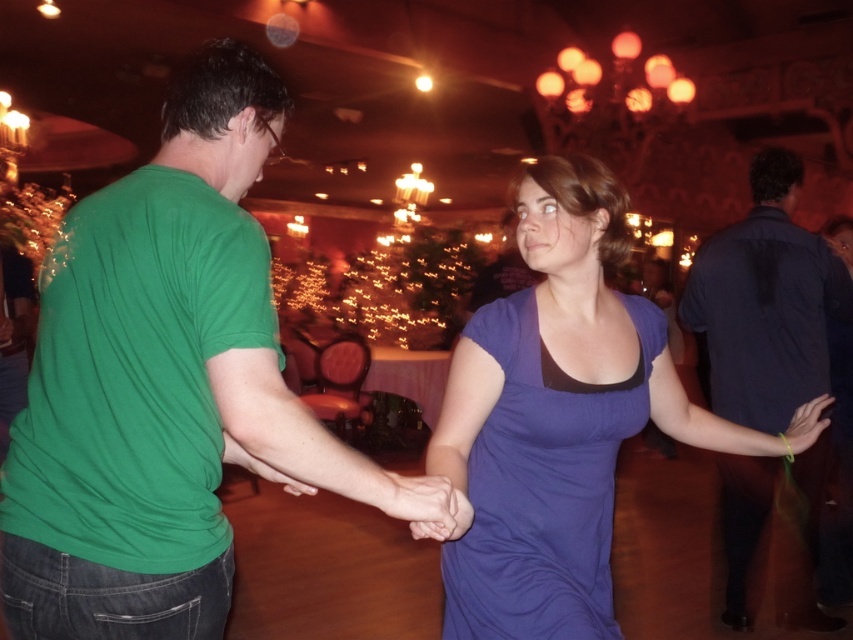
In the scene shown: You are at a party and want to take a photo of the purple soft fabric dress at center and the dark blue shirt at right. Since you want them both in focus, which one should you focus on first? Please explain why based on their positions.

You should focus on the purple soft fabric dress at center first because it is closer to you than the dark blue shirt at right. In photography, focusing on the closer object ensures both are in focus when using a shallow depth of field.

You are a photographer at the event and want to capture a photo of both the purple satin dress at center and the purple soft fabric dress at center. Since you want the taller dress to stand out, which one should you focus on?

The purple satin dress at center has a greater height compared to the purple soft fabric dress at center, so you should focus on the purple satin dress at center to highlight its taller stature.